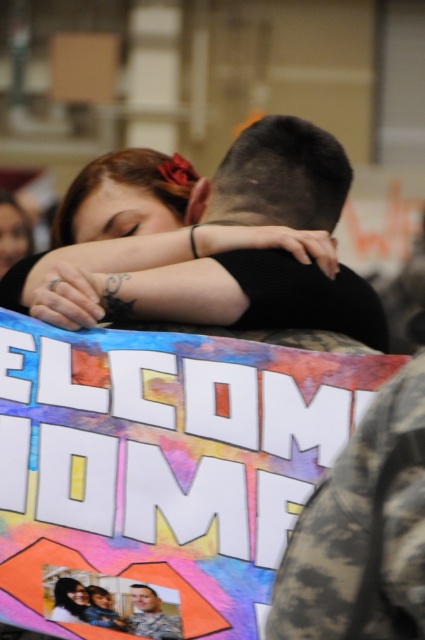
Who is positioned more to the left, dark brown hair at upper center or camouflage uniform at center?

camouflage uniform at center

The height and width of the screenshot is (640, 425). In order to click on dark brown hair at upper center in this screenshot , I will do `click(193, 289)`.

Locate an element on the screen. The height and width of the screenshot is (640, 425). dark brown hair at upper center is located at coordinates pos(193,289).

Which of these two, camouflage uniform at center or matte black hair at upper left, stands shorter?

Standing shorter between the two is matte black hair at upper left.

Does camouflage uniform at center have a greater width compared to matte black hair at upper left?

Indeed, camouflage uniform at center has a greater width compared to matte black hair at upper left.

Is point (149, 634) positioned behind point (59, 600)?

Yes, it is.

The height and width of the screenshot is (640, 425). I want to click on camouflage uniform at center, so click(150, 616).

Who is higher up, dark brown hair at upper center or matte black hair at upper left?

Positioned higher is dark brown hair at upper center.

Does dark brown hair at upper center appear over matte black hair at upper left?

Indeed, dark brown hair at upper center is positioned over matte black hair at upper left.

This screenshot has height=640, width=425. Describe the element at coordinates (193, 289) in the screenshot. I see `dark brown hair at upper center` at that location.

At what (x,y) coordinates should I click in order to perform the action: click on dark brown hair at upper center. Please return your answer as a coordinate pair (x, y). This screenshot has height=640, width=425. Looking at the image, I should click on (193, 289).